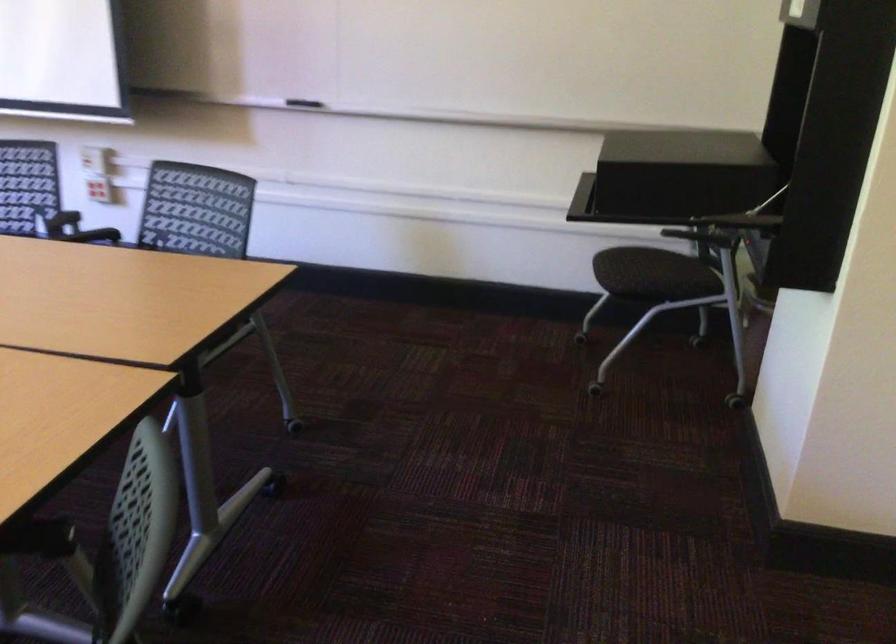
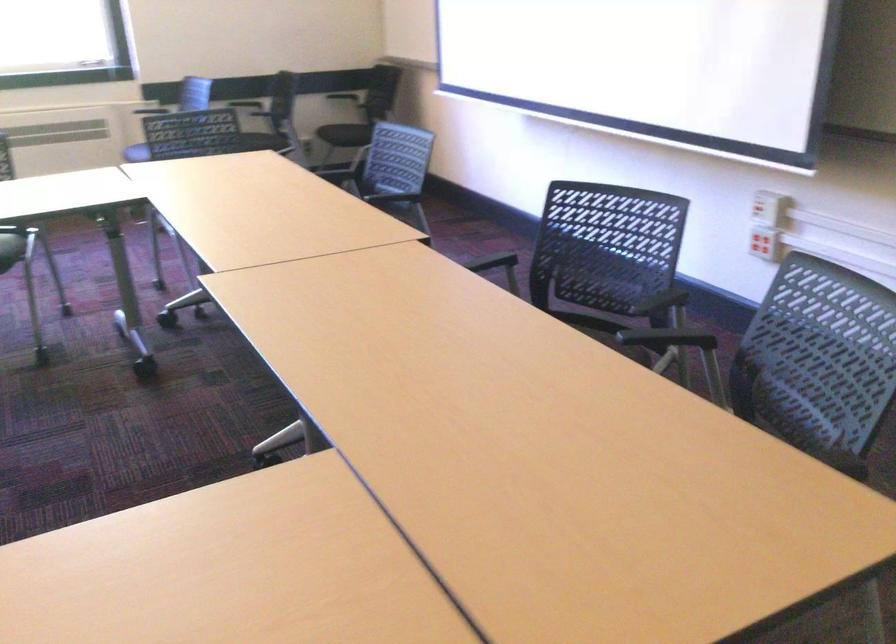
Question: The camera is either moving clockwise (left) or counter-clockwise (right) around the object. The first image is from the beginning of the video and the second image is from the end. Is the camera moving left or right when shooting the video?

Choices:
 (A) Left
 (B) Right

Answer: (B)